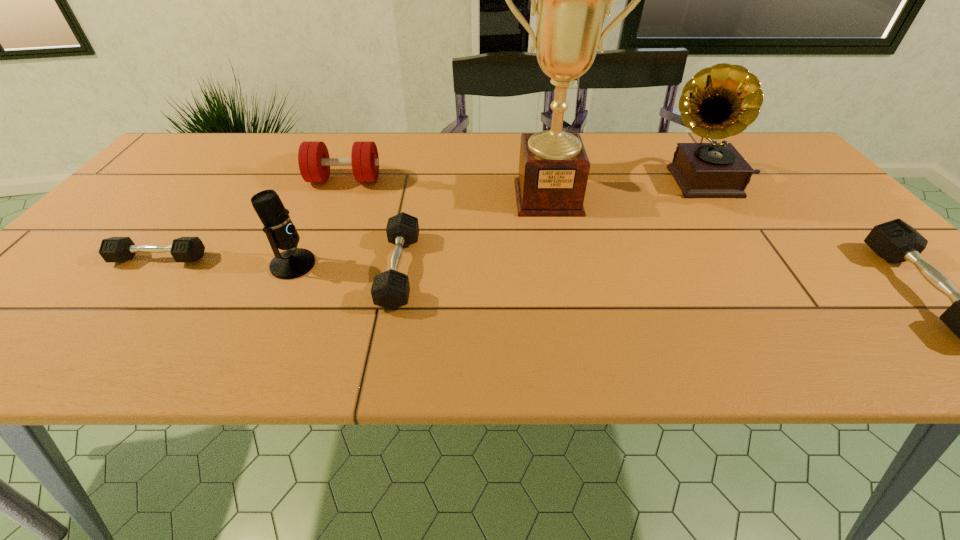
You are a GUI agent. You are given a task and a screenshot of the screen. Output one action in this format:
    pyautogui.click(x=<x>, y=<y>)
    Task: Click on the third tallest object
    
    Given the screenshot: What is the action you would take?
    pyautogui.click(x=294, y=262)

This screenshot has height=540, width=960. I want to click on vacant area situated 0.250m on the right of the shortest dumbbell, so click(320, 259).

Identify the location of vacant region located 0.400m on the left of the second shortest dumbbell. (x=196, y=269).

Where is `free point located 0.220m on the plaque of the tallest object`? The image size is (960, 540). free point located 0.220m on the plaque of the tallest object is located at coordinates (564, 280).

You are a GUI agent. You are given a task and a screenshot of the screen. Output one action in this format:
    pyautogui.click(x=<x>, y=<y>)
    Task: Click on the vacant space positioned 0.050m from the horn of the phonograph record
    This screenshot has width=960, height=540.
    Given the screenshot: What is the action you would take?
    pyautogui.click(x=636, y=181)

Identify the location of free space located 0.270m from the horn of the phonograph record. The width and height of the screenshot is (960, 540). (554, 181).

The image size is (960, 540). In order to click on vacant space located from the horn of the phonograph record in this screenshot , I will do `click(505, 181)`.

Locate an element on the screen. free space located 0.390m on the left of the third dumbbell from right to left is located at coordinates (164, 179).

At what (x,y) coordinates should I click in order to perform the action: click on free location located 0.370m on the back of the third tallest object. Please return your answer as a coordinate pair (x, y). The image size is (960, 540). Looking at the image, I should click on (338, 165).

Find the location of a particular element. phonograph record present at the far edge is located at coordinates (720, 101).